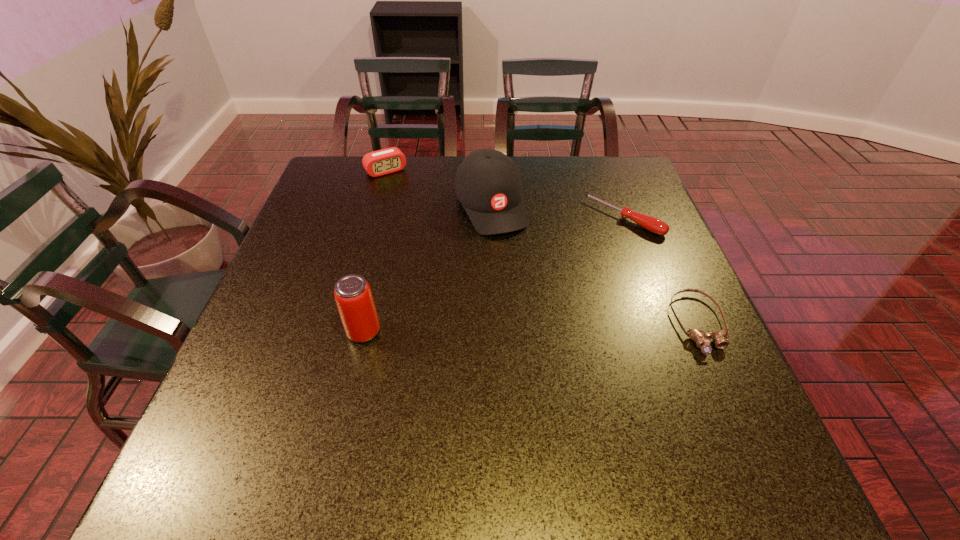
I want to click on beer can, so click(x=353, y=296).

Identify the location of the shortest object. (720, 340).

At what (x,y) coordinates should I click in order to perform the action: click on the third object from left to right. Please return your answer as a coordinate pair (x, y). Looking at the image, I should click on (488, 184).

Locate an element on the screen. screwdriver is located at coordinates (652, 224).

You are a GUI agent. You are given a task and a screenshot of the screen. Output one action in this format:
    pyautogui.click(x=<x>, y=<y>)
    Task: Click on the third shortest object
    The height and width of the screenshot is (540, 960).
    Given the screenshot: What is the action you would take?
    pyautogui.click(x=389, y=160)

Identify the location of vacant space located 0.150m on the front of the beer can. This screenshot has width=960, height=540. (345, 413).

You are a GUI agent. You are given a task and a screenshot of the screen. Output one action in this format:
    pyautogui.click(x=<x>, y=<y>)
    Task: Click on the free region located on the front lenses and sides of the goggles
    The height and width of the screenshot is (540, 960).
    Given the screenshot: What is the action you would take?
    pyautogui.click(x=727, y=386)

In order to click on vacant point located 0.090m with a logo on the front of the baseball cap in this screenshot , I will do `click(513, 259)`.

I want to click on blank area located 0.050m with a logo on the front of the baseball cap, so click(507, 249).

Locate an element on the screen. vacant space located with a logo on the front of the baseball cap is located at coordinates (553, 342).